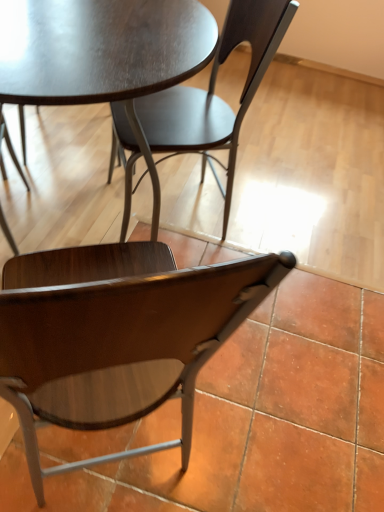
You are a GUI agent. You are given a task and a screenshot of the screen. Output one action in this format:
    pyautogui.click(x=<x>, y=<y>)
    Task: Click on the matte dark wood chair at center, the 2th chair ordered from the bottom
    The image size is (384, 512).
    Given the screenshot: What is the action you would take?
    pyautogui.click(x=214, y=95)

You are a GUI agent. You are given a task and a screenshot of the screen. Output one action in this format:
    pyautogui.click(x=<x>, y=<y>)
    Task: Click on the matte dark wood chair at center, the 2th chair ordered from the bottom
    The height and width of the screenshot is (512, 384).
    Given the screenshot: What is the action you would take?
    pyautogui.click(x=214, y=95)

Measure the distance between wooden chair at lower center, the second chair in the top-to-bottom sequence, and matte dark wood table at center.

wooden chair at lower center, the second chair in the top-to-bottom sequence, is 53.64 centimeters from matte dark wood table at center.

Does point (185, 379) appear closer or farther from the camera than point (133, 0)?

Point (185, 379) appears to be closer to the viewer than point (133, 0).

Is matte dark wood table at center at the back of wooden chair at lower center, the second chair in the top-to-bottom sequence?

Answer: wooden chair at lower center, the second chair in the top-to-bottom sequence, does not have its back to matte dark wood table at center.

Between wooden chair at lower center, which ranks as the 1th chair in bottom-to-top order, and matte dark wood table at center, which one has less height?

matte dark wood table at center is shorter.

Is wooden chair at lower center, which ranks as the 1th chair in bottom-to-top order, to the right of matte dark wood chair at center, the 2th chair ordered from the bottom, from the viewer's perspective?

No.

Consider the image. From the image's perspective, relative to matte dark wood chair at center, which is the 1th chair from top to bottom, is wooden chair at lower center, which ranks as the 1th chair in bottom-to-top order, above or below?

wooden chair at lower center, which ranks as the 1th chair in bottom-to-top order, is below matte dark wood chair at center, which is the 1th chair from top to bottom.

In order to click on chair below the wooden chair at lower center, the second chair in the top-to-bottom sequence (from a real-world perspective) in this screenshot , I will do `click(214, 95)`.

Can you confirm if matte dark wood table at center is thinner than matte dark wood chair at center, the 2th chair ordered from the bottom?

No.

Is there a large distance between matte dark wood table at center and matte dark wood chair at center, the 2th chair ordered from the bottom?

That's not correct — matte dark wood table at center is a little close to matte dark wood chair at center, the 2th chair ordered from the bottom.

Is matte dark wood table at center completely or partially outside of matte dark wood chair at center, which is the 1th chair from top to bottom?

Absolutely, matte dark wood table at center is external to matte dark wood chair at center, which is the 1th chair from top to bottom.

Measure the distance between matte dark wood table at center and matte dark wood chair at center, the 2th chair ordered from the bottom.

matte dark wood table at center and matte dark wood chair at center, the 2th chair ordered from the bottom, are 9.41 inches apart.

From the image's perspective, which is below, matte dark wood chair at center, which is the 1th chair from top to bottom, or matte dark wood table at center?

matte dark wood table at center appears lower in the image.

Does matte dark wood chair at center, the 2th chair ordered from the bottom, have a lesser height compared to matte dark wood table at center?

No.

Consider the image. Could you measure the distance between matte dark wood chair at center, which is the 1th chair from top to bottom, and matte dark wood table at center?

9.41 inches.

Looking at this image, based on their sizes in the image, would you say matte dark wood chair at center, which is the 1th chair from top to bottom, is bigger or smaller than matte dark wood table at center?

In the image, matte dark wood chair at center, which is the 1th chair from top to bottom, appears to be smaller than matte dark wood table at center.

Is matte dark wood table at center at the right side of wooden chair at lower center, the second chair in the top-to-bottom sequence?

No, matte dark wood table at center is not to the right of wooden chair at lower center, the second chair in the top-to-bottom sequence.

Identify the location of chair that is in front of the matte dark wood table at center. (116, 336).

Measure the distance from matte dark wood table at center to wooden chair at lower center, which ranks as the 1th chair in bottom-to-top order.

A distance of 21.12 inches exists between matte dark wood table at center and wooden chair at lower center, which ranks as the 1th chair in bottom-to-top order.

From the picture: Considering the sizes of objects matte dark wood table at center and wooden chair at lower center, the second chair in the top-to-bottom sequence, in the image provided, who is bigger, matte dark wood table at center or wooden chair at lower center, the second chair in the top-to-bottom sequence,?

matte dark wood table at center.

Considering the sizes of objects matte dark wood chair at center, the 2th chair ordered from the bottom, and wooden chair at lower center, which ranks as the 1th chair in bottom-to-top order, in the image provided, who is wider, matte dark wood chair at center, the 2th chair ordered from the bottom, or wooden chair at lower center, which ranks as the 1th chair in bottom-to-top order,?

Wider between the two is wooden chair at lower center, which ranks as the 1th chair in bottom-to-top order.

Considering the relative positions of matte dark wood chair at center, which is the 1th chair from top to bottom, and wooden chair at lower center, which ranks as the 1th chair in bottom-to-top order, in the image provided, is matte dark wood chair at center, which is the 1th chair from top to bottom, in front of wooden chair at lower center, which ranks as the 1th chair in bottom-to-top order,?

No, it is behind wooden chair at lower center, which ranks as the 1th chair in bottom-to-top order.

Identify the location of chair below the matte dark wood chair at center, the 2th chair ordered from the bottom (from the image's perspective). Image resolution: width=384 pixels, height=512 pixels. (116, 336).

Find the location of `chair located in front of the matte dark wood table at center`. chair located in front of the matte dark wood table at center is located at coordinates (116, 336).

This screenshot has height=512, width=384. I want to click on chair located above the matte dark wood chair at center, the 2th chair ordered from the bottom (from a real-world perspective), so pyautogui.click(x=116, y=336).

Based on their spatial positions, is wooden chair at lower center, which ranks as the 1th chair in bottom-to-top order, or matte dark wood table at center closer to matte dark wood chair at center, which is the 1th chair from top to bottom?

matte dark wood table at center lies closer to matte dark wood chair at center, which is the 1th chair from top to bottom, than the other object.

Based on their spatial positions, is matte dark wood table at center or matte dark wood chair at center, which is the 1th chair from top to bottom, further from wooden chair at lower center, which ranks as the 1th chair in bottom-to-top order?

matte dark wood chair at center, which is the 1th chair from top to bottom, lies further to wooden chair at lower center, which ranks as the 1th chair in bottom-to-top order, than the other object.

When comparing their distances from matte dark wood table at center, does matte dark wood chair at center, which is the 1th chair from top to bottom, or wooden chair at lower center, which ranks as the 1th chair in bottom-to-top order, seem further?

wooden chair at lower center, which ranks as the 1th chair in bottom-to-top order, lies further to matte dark wood table at center than the other object.

Based on their spatial positions, is wooden chair at lower center, the second chair in the top-to-bottom sequence, or matte dark wood chair at center, which is the 1th chair from top to bottom, further from matte dark wood table at center?

wooden chair at lower center, the second chair in the top-to-bottom sequence, is further to matte dark wood table at center.

Estimate the real-world distances between objects in this image. Which object is further from wooden chair at lower center, the second chair in the top-to-bottom sequence, matte dark wood chair at center, which is the 1th chair from top to bottom, or matte dark wood table at center?

matte dark wood chair at center, which is the 1th chair from top to bottom, is further to wooden chair at lower center, the second chair in the top-to-bottom sequence.

Which object lies further to the anchor point matte dark wood chair at center, which is the 1th chair from top to bottom, matte dark wood table at center or wooden chair at lower center, which ranks as the 1th chair in bottom-to-top order?

wooden chair at lower center, which ranks as the 1th chair in bottom-to-top order, is positioned further to the anchor matte dark wood chair at center, which is the 1th chair from top to bottom.

Locate an element on the screen. This screenshot has width=384, height=512. coffee table between matte dark wood chair at center, the 2th chair ordered from the bottom, and wooden chair at lower center, which ranks as the 1th chair in bottom-to-top order, vertically is located at coordinates (99, 49).